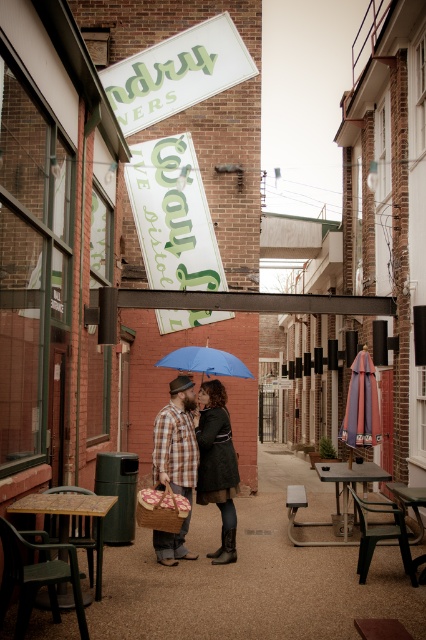
Question: Does plaid fabric shirt at center lie behind blue matte umbrella at center?

Choices:
 (A) yes
 (B) no

Answer: (B)

Question: Considering the real-world distances, which object is farthest from the plaid fabric shirt at center?

Choices:
 (A) wooden picnic table at lower left
 (B) blue matte umbrella at center
 (C) metallic silver picnic table at lower right

Answer: (C)

Question: Does matte black jacket at center appear on the right side of blue matte umbrella at center?

Choices:
 (A) yes
 (B) no

Answer: (A)

Question: Is brown concrete pavement at lower left above metallic silver picnic table at lower right?

Choices:
 (A) no
 (B) yes

Answer: (A)

Question: Which is farther from the matte black jacket at center?

Choices:
 (A) brown concrete pavement at lower left
 (B) wooden picnic table at lower left
 (C) blue matte umbrella at center
 (D) plaid fabric shirt at center

Answer: (B)

Question: Among these points, which one is nearest to the camera?

Choices:
 (A) (158, 365)
 (B) (66, 524)

Answer: (B)